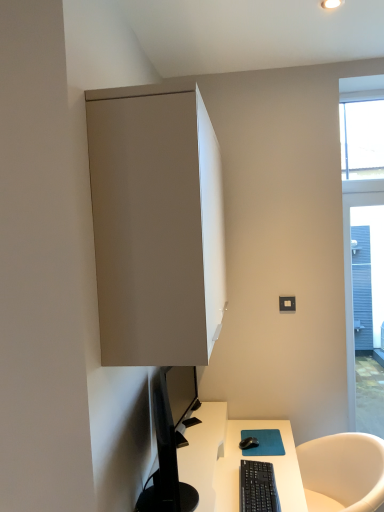
The width and height of the screenshot is (384, 512). In order to click on free space to the back side of black matte mouse at lower center in this screenshot , I will do click(x=258, y=433).